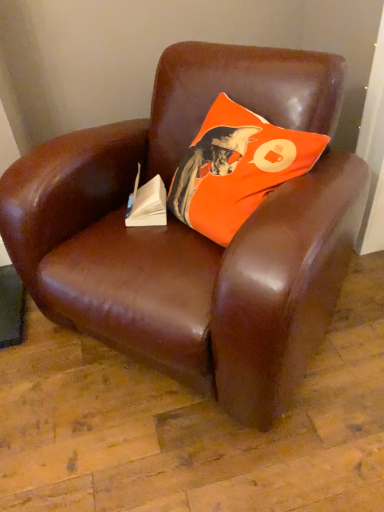
Locate an element on the screen. This screenshot has height=512, width=384. brown leather chair at center is located at coordinates coord(195,232).

What do you see at coordinates (236, 168) in the screenshot?
I see `orange fabric pillow at upper center` at bounding box center [236, 168].

The width and height of the screenshot is (384, 512). What do you see at coordinates (147, 203) in the screenshot?
I see `white paper at center` at bounding box center [147, 203].

Identify the location of brown leather chair at center. (195, 232).

Is white paper at center far from orange fabric pillow at upper center?

No, white paper at center is not far away from orange fabric pillow at upper center.

Which object is positioned more to the right, white paper at center or orange fabric pillow at upper center?

Positioned to the right is orange fabric pillow at upper center.

From a real-world perspective, is white paper at center on top of orange fabric pillow at upper center?

No.

Image resolution: width=384 pixels, height=512 pixels. I want to click on paperback book behind the orange fabric pillow at upper center, so click(x=147, y=203).

In terms of height, does brown leather chair at center look taller or shorter compared to white paper at center?

Considering their sizes, brown leather chair at center has more height than white paper at center.

Is point (266, 208) closer to camera compared to point (158, 177)?

Yes, it is in front of point (158, 177).

From the image's perspective, is brown leather chair at center over white paper at center?

No, from the image's perspective, brown leather chair at center is not on top of white paper at center.

Measure the distance from orange fabric pillow at upper center to white paper at center.

They are 8.92 inches apart.

From the picture: From the image's perspective, is orange fabric pillow at upper center over white paper at center?

Yes.

Looking at this image, is orange fabric pillow at upper center in contact with white paper at center?

orange fabric pillow at upper center is not next to white paper at center, and they're not touching.

Considering the points (199, 165) and (154, 205), which point is behind, point (199, 165) or point (154, 205)?

Point (154, 205)

Based on the photo, which of these two, white paper at center or brown leather chair at center, is thinner?

white paper at center is thinner.

Between white paper at center and brown leather chair at center, which one is positioned behind?

white paper at center is more distant.

Is there a large distance between white paper at center and brown leather chair at center?

white paper at center is actually quite close to brown leather chair at center.

Can you tell me how much brown leather chair at center and orange fabric pillow at upper center differ in facing direction?

The facing directions of brown leather chair at center and orange fabric pillow at upper center are 30.5 degrees apart.

Considering the sizes of objects brown leather chair at center and orange fabric pillow at upper center in the image provided, who is taller, brown leather chair at center or orange fabric pillow at upper center?

brown leather chair at center.

Considering the sizes of brown leather chair at center and orange fabric pillow at upper center in the image, is brown leather chair at center wider or thinner than orange fabric pillow at upper center?

Considering their sizes, brown leather chair at center looks broader than orange fabric pillow at upper center.

From the image's perspective, is orange fabric pillow at upper center beneath brown leather chair at center?

No, from the image's perspective, orange fabric pillow at upper center is not below brown leather chair at center.

Which of these two, orange fabric pillow at upper center or brown leather chair at center, is wider?

brown leather chair at center is wider.

Relative to brown leather chair at center, is orange fabric pillow at upper center in front or behind?

orange fabric pillow at upper center is behind brown leather chair at center.

You are a GUI agent. You are given a task and a screenshot of the screen. Output one action in this format:
    pyautogui.click(x=<x>, y=<y>)
    Task: Click on the pillow on the right side of white paper at center
    The image size is (384, 512).
    Given the screenshot: What is the action you would take?
    pyautogui.click(x=236, y=168)

Where is `paperback book on the left of brown leather chair at center`? paperback book on the left of brown leather chair at center is located at coordinates (147, 203).

Estimate the real-world distances between objects in this image. Which object is closer to orange fabric pillow at upper center, white paper at center or brown leather chair at center?

brown leather chair at center.

When comparing their distances from white paper at center, does brown leather chair at center or orange fabric pillow at upper center seem closer?

orange fabric pillow at upper center is closer to white paper at center.

Looking at the image, which one is located further to brown leather chair at center, orange fabric pillow at upper center or white paper at center?

white paper at center is positioned further to the anchor brown leather chair at center.

Looking at the image, which one is located further to brown leather chair at center, white paper at center or orange fabric pillow at upper center?

white paper at center is positioned further to the anchor brown leather chair at center.

From the image, which object appears to be nearer to white paper at center, orange fabric pillow at upper center or brown leather chair at center?

The object closer to white paper at center is orange fabric pillow at upper center.

Considering their positions, is brown leather chair at center positioned further to orange fabric pillow at upper center than white paper at center?

Among the two, white paper at center is located further to orange fabric pillow at upper center.

This screenshot has width=384, height=512. Identify the location of pillow between brown leather chair at center and white paper at center in the front-back direction. (236, 168).